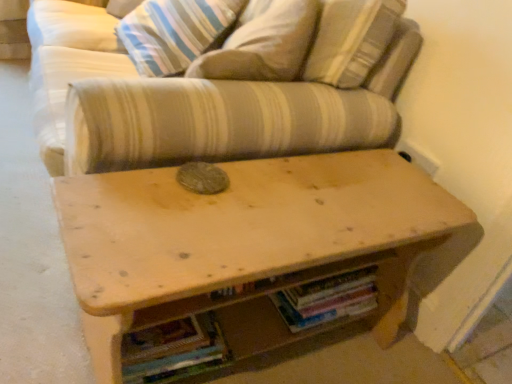
Locate an element on the screen. striped fabric pillow at upper center is located at coordinates (175, 32).

Measure the distance between multicolored paper book at lower center, acting as the second book starting from the right, and camera.

A distance of 36.02 inches exists between multicolored paper book at lower center, acting as the second book starting from the right, and camera.

Locate an element on the screen. The image size is (512, 384). striped fabric pillow at upper center is located at coordinates (175, 32).

From a real-world perspective, who is located higher, hardcover books at center, which ranks as the 2th book in left-to-right order, or multicolored paper book at lower center, acting as the 1th book starting from the left?

In real-world perspective, hardcover books at center, which ranks as the 2th book in left-to-right order, is above.

Can multicolored paper book at lower center, acting as the 1th book starting from the left, be found inside hardcover books at center, the 1th book viewed from the right?

No.

Is hardcover books at center, the 1th book viewed from the right, in front of or behind multicolored paper book at lower center, acting as the second book starting from the right, in the image?

hardcover books at center, the 1th book viewed from the right, is positioned farther from the viewer than multicolored paper book at lower center, acting as the second book starting from the right.

From the image's perspective, between striped fabric couch at center and wooden table at center, who is located below?

wooden table at center, from the image's perspective.

Between striped fabric couch at center and wooden table at center, which one has less height?

striped fabric couch at center is shorter.

Is striped fabric couch at center further to camera compared to wooden table at center?

Yes, striped fabric couch at center is behind wooden table at center.

Is striped fabric couch at center bigger than wooden table at center?

Correct, striped fabric couch at center is larger in size than wooden table at center.

Considering the positions of objects striped fabric pillow at upper center and wooden table at center in the image provided, who is more to the left, striped fabric pillow at upper center or wooden table at center?

striped fabric pillow at upper center is more to the left.

Considering the sizes of striped fabric pillow at upper center and wooden table at center in the image, is striped fabric pillow at upper center bigger or smaller than wooden table at center?

In the image, striped fabric pillow at upper center appears to be smaller than wooden table at center.

Considering the positions of objects striped fabric pillow at upper center and wooden table at center in the image provided, who is behind, striped fabric pillow at upper center or wooden table at center?

striped fabric pillow at upper center is further from the camera.

Based on the photo, what's the angular difference between striped fabric pillow at upper center and wooden table at center's facing directions?

The angle between the facing direction of striped fabric pillow at upper center and the facing direction of wooden table at center is 73.9 degrees.

From a real-world perspective, is multicolored paper book at lower center, acting as the second book starting from the right, on top of striped fabric couch at center?

Actually, multicolored paper book at lower center, acting as the second book starting from the right, is physically below striped fabric couch at center in the real world.

This screenshot has width=512, height=384. I want to click on book that is the 1st one when counting backward from the striped fabric couch at center, so click(174, 350).

Does multicolored paper book at lower center, acting as the 1th book starting from the left, touch striped fabric couch at center?

multicolored paper book at lower center, acting as the 1th book starting from the left, and striped fabric couch at center are clearly separated.

Would you say hardcover books at center, the 1th book viewed from the right, is to the left or to the right of wooden table at center in the picture?

Clearly, hardcover books at center, the 1th book viewed from the right, is on the right of wooden table at center in the image.

Is hardcover books at center, which ranks as the 2th book in left-to-right order, aimed at wooden table at center?

Yes.

Is hardcover books at center, which ranks as the 2th book in left-to-right order, outside of wooden table at center?

No, hardcover books at center, which ranks as the 2th book in left-to-right order, is inside or overlapping with wooden table at center.

Who is shorter, multicolored paper book at lower center, acting as the 1th book starting from the left, or wooden table at center?

multicolored paper book at lower center, acting as the 1th book starting from the left, is shorter.

This screenshot has width=512, height=384. Identify the location of table located above the multicolored paper book at lower center, acting as the second book starting from the right (from the image's perspective). (244, 238).

Which is more to the left, multicolored paper book at lower center, acting as the 1th book starting from the left, or wooden table at center?

multicolored paper book at lower center, acting as the 1th book starting from the left.

Does multicolored paper book at lower center, acting as the second book starting from the right, have a smaller size compared to wooden table at center?

Indeed, multicolored paper book at lower center, acting as the second book starting from the right, has a smaller size compared to wooden table at center.

How different are the orientations of hardcover books at center, which ranks as the 2th book in left-to-right order, and striped fabric pillow at upper center in degrees?

The angle between the facing direction of hardcover books at center, which ranks as the 2th book in left-to-right order, and the facing direction of striped fabric pillow at upper center is 74.2 degrees.

From a real-world perspective, is hardcover books at center, which ranks as the 2th book in left-to-right order, on top of striped fabric pillow at upper center?

No, from a real-world perspective, hardcover books at center, which ranks as the 2th book in left-to-right order, is not above striped fabric pillow at upper center.

Is point (350, 308) more distant than point (199, 19)?

No, it is in front of (199, 19).

Locate an element on the screen. book located in front of the hardcover books at center, the 1th book viewed from the right is located at coordinates (174, 350).

Locate an element on the screen. The image size is (512, 384). studio couch above the wooden table at center (from a real-world perspective) is located at coordinates (231, 96).

Looking at the image, which one is located further to wooden table at center, striped fabric couch at center or hardcover books at center, which ranks as the 2th book in left-to-right order?

Among the two, striped fabric couch at center is located further to wooden table at center.

Estimate the real-world distances between objects in this image. Which object is closer to striped fabric pillow at upper center, striped fabric couch at center or multicolored paper book at lower center, acting as the 1th book starting from the left?

striped fabric couch at center.

Looking at this image, when comparing their distances from striped fabric pillow at upper center, does hardcover books at center, which ranks as the 2th book in left-to-right order, or multicolored paper book at lower center, acting as the second book starting from the right, seem closer?

Among the two, hardcover books at center, which ranks as the 2th book in left-to-right order, is located nearer to striped fabric pillow at upper center.

Looking at the image, which one is located closer to striped fabric pillow at upper center, multicolored paper book at lower center, acting as the second book starting from the right, or hardcover books at center, the 1th book viewed from the right?

Among the two, hardcover books at center, the 1th book viewed from the right, is located nearer to striped fabric pillow at upper center.

Looking at the image, which one is located closer to striped fabric couch at center, striped fabric pillow at upper center or wooden table at center?

Based on the image, wooden table at center appears to be nearer to striped fabric couch at center.

Estimate the real-world distances between objects in this image. Which object is closer to multicolored paper book at lower center, acting as the second book starting from the right, striped fabric couch at center or hardcover books at center, the 1th book viewed from the right?

hardcover books at center, the 1th book viewed from the right, is closer to multicolored paper book at lower center, acting as the second book starting from the right.

Based on their spatial positions, is hardcover books at center, which ranks as the 2th book in left-to-right order, or striped fabric couch at center further from striped fabric pillow at upper center?

hardcover books at center, which ranks as the 2th book in left-to-right order, lies further to striped fabric pillow at upper center than the other object.

Considering their positions, is multicolored paper book at lower center, acting as the second book starting from the right, positioned further to hardcover books at center, which ranks as the 2th book in left-to-right order, than wooden table at center?

Based on the image, multicolored paper book at lower center, acting as the second book starting from the right, appears to be further to hardcover books at center, which ranks as the 2th book in left-to-right order.

Where is `table between striped fabric pillow at upper center and hardcover books at center, the 1th book viewed from the right, from top to bottom`? This screenshot has width=512, height=384. table between striped fabric pillow at upper center and hardcover books at center, the 1th book viewed from the right, from top to bottom is located at coordinates (244, 238).

Where is `studio couch between striped fabric pillow at upper center and multicolored paper book at lower center, acting as the 1th book starting from the left, vertically`? The image size is (512, 384). studio couch between striped fabric pillow at upper center and multicolored paper book at lower center, acting as the 1th book starting from the left, vertically is located at coordinates (231, 96).

At what (x,y) coordinates should I click in order to perform the action: click on table between striped fabric couch at center and hardcover books at center, the 1th book viewed from the right, in the vertical direction. Please return your answer as a coordinate pair (x, y). The image size is (512, 384). Looking at the image, I should click on (244, 238).

Identify the location of table between striped fabric pillow at upper center and multicolored paper book at lower center, acting as the second book starting from the right, from top to bottom. This screenshot has width=512, height=384. (244, 238).